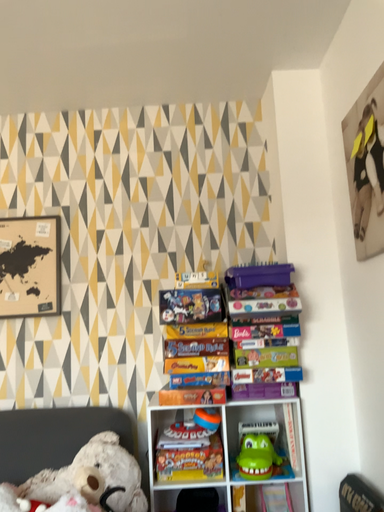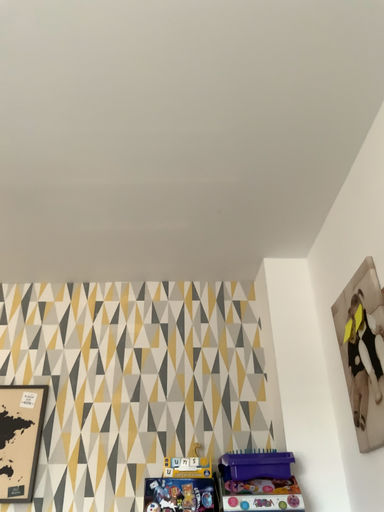
Question: Which way did the camera rotate in the video?

Choices:
 (A) rotated downward
 (B) rotated upward

Answer: (B)